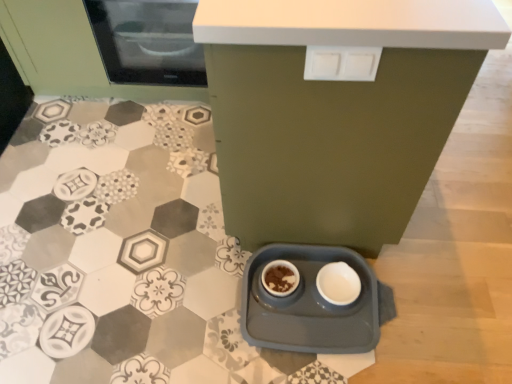
Identify the location of free space between matte green cabinet at lower center and gray plastic tray at lower center. (237, 289).